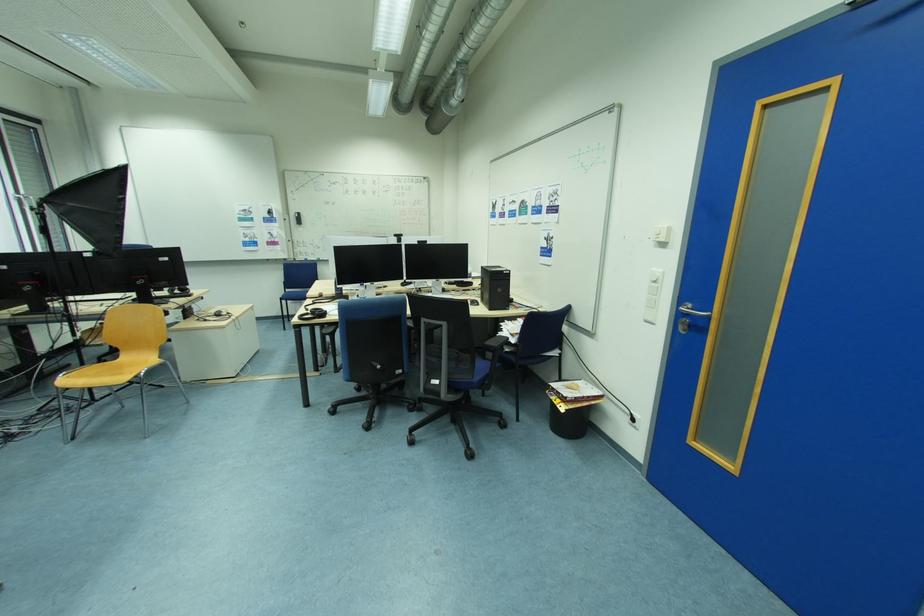
Identify the location of small plastic bottle. (375, 291).